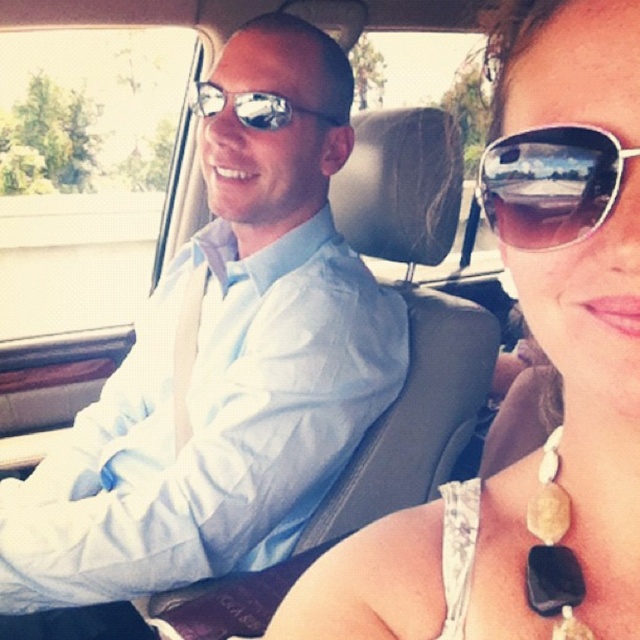
You are sitting in the backseat of a car and see two points marked on the window. The first point is at coordinates point (189, 518) and the second is at point (572, 600). Which point is closer to you?

Point (189, 518) is closer to you because it is further to the viewer than point (572, 600).

Consider the image. You are a photographer trying to capture a closeup shot of both the matte light blue shirt at center and the black stone necklace at lower right in the car. Given that your camera lens has a maximum focus range of 30 inches, will you be able to focus on both objects simultaneously?

The matte light blue shirt at center and the black stone necklace at lower right are 31.97 inches apart from each other, which exceeds the camera lens maximum focus range of 30 inches. Therefore, you cannot focus on both objects simultaneously.

You are a photographer trying to capture a closeup of the matte white tank top at center and the sunglasses at right. Since the tank top is closer to you, will you need to adjust your focus to include both items clearly in the photo?

The matte white tank top at center is in front of the sunglasses at right, so if you focus on the tank top, the sunglasses at right will be slightly out of focus. To have both items clear, adjust the focus so that both are within the depth of field.